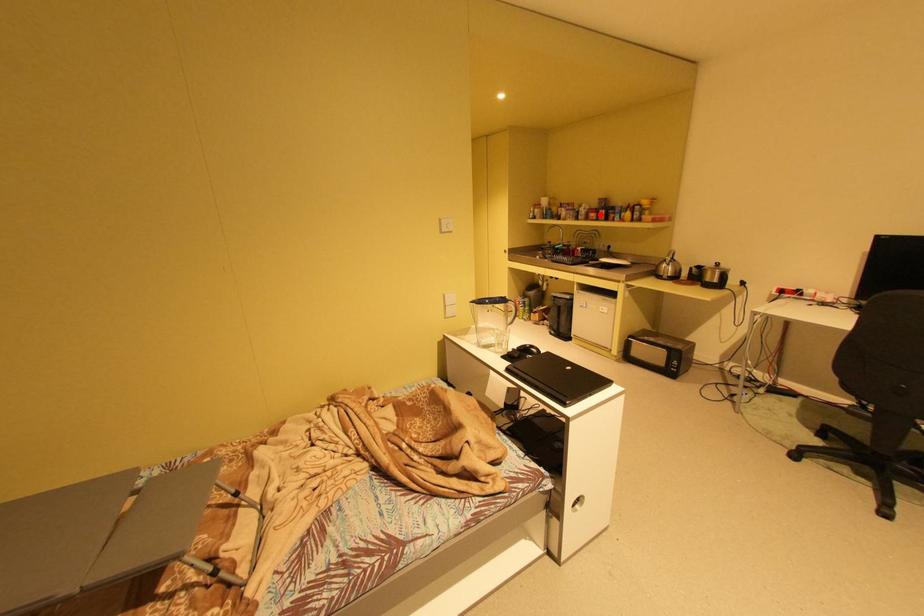
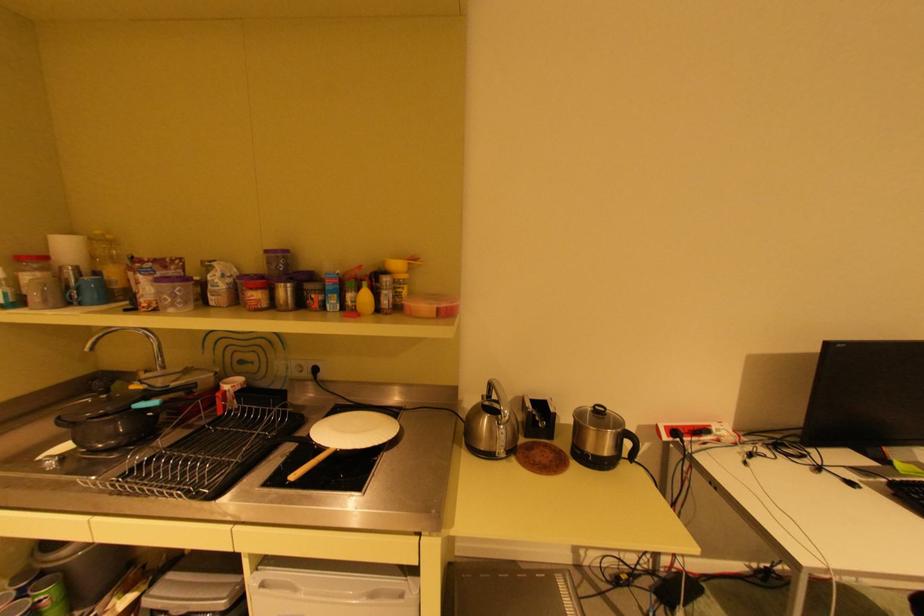
Question: I am providing you with two images of the same scene from different viewpoints. Given a red point in image1, look at the same physical point in image2. Is it:

Choices:
 (A) Closer to the viewpoint
 (B) Farther from the viewpoint

Answer: (B)